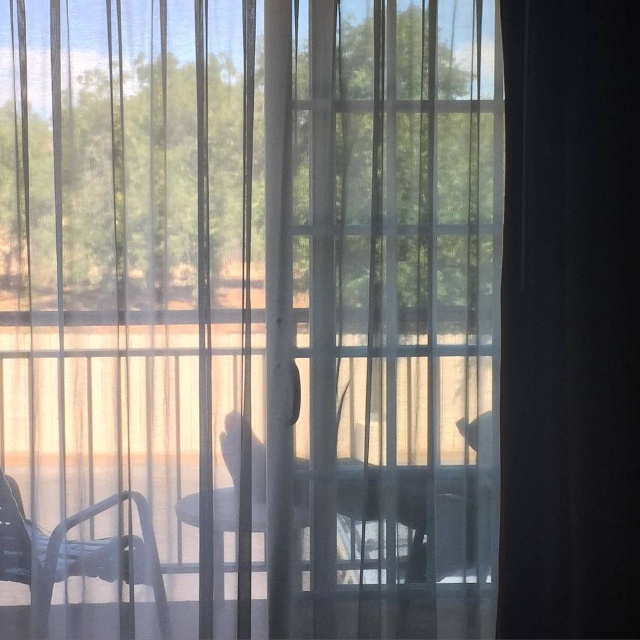
You are trying to place a large potted plant between the transparent fabric screen door at center and the clear glass table at center. Based on their widths, can the plant fit between them?

The transparent fabric screen door at center might be wider than clear glass table at center, so there might be enough space for the plant to fit between them, but it depends on the exact width difference.

You are standing in front of the vertical blinds in the scene. You notice two points marked on the image. Which point, point (598,611) or point (86,564), is closer to you?

Point (598,611) is closer to the viewer than point (86,564).